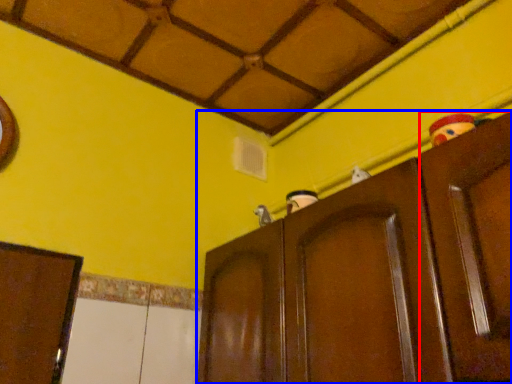
Question: Among these objects, which one is nearest to the camera, door (highlighted by a red box) or cupboard (highlighted by a blue box)?

Choices:
 (A) door
 (B) cupboard

Answer: (A)